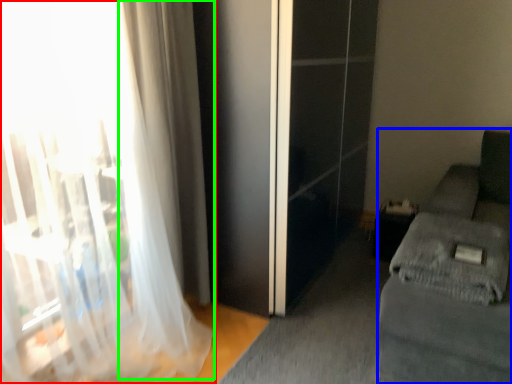
Question: Which object is positioned closest to curtain (highlighted by a red box)? Select from studio couch (highlighted by a blue box) and curtain (highlighted by a green box).

Choices:
 (A) studio couch
 (B) curtain

Answer: (B)